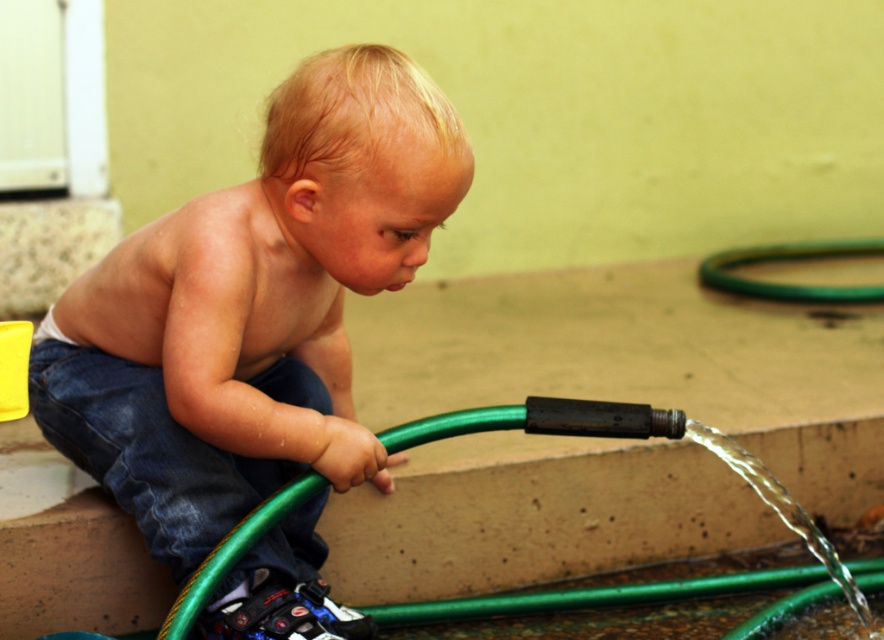
Based on the photo, you are a photographer setting up a shoot in this scene. You need to position a light to the left of both the smooth denim jeans at left and the denim at left. Is this possible given their positions?

The smooth denim jeans at left are to the right of the denim at left. Since the smooth denim jeans at left are positioned to the right of the denim at left, there is no space to the left of both objects simultaneously. Therefore, you cannot place the light to the left of both the smooth denim jeans at left and the denim at left.

You are standing in the garden where the child is playing with the hose. There are two points marked in the image. Which point, point (x=105, y=429) or point (x=715, y=269), is closer to you?

Point (x=105, y=429) is closer to the viewer than point (x=715, y=269).